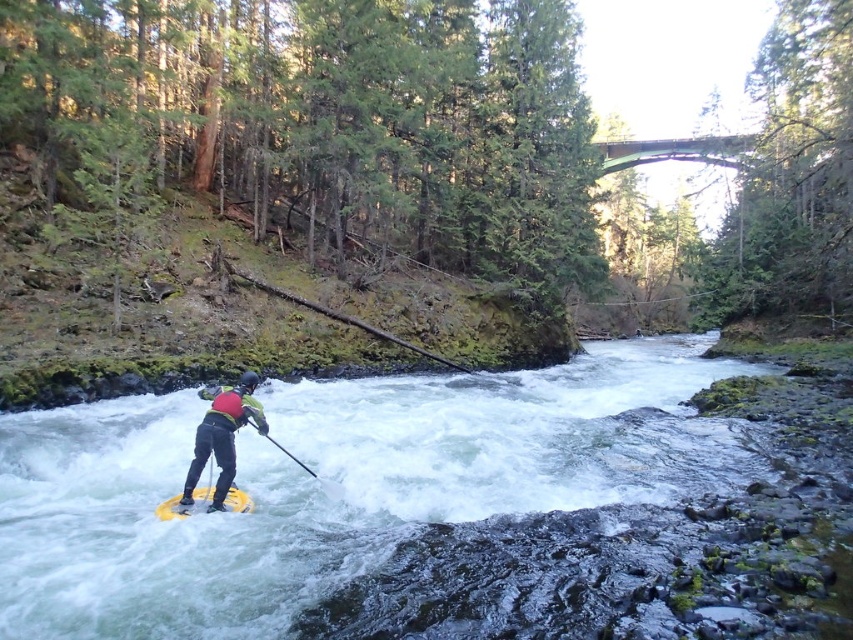
You are a kayaker in the river and you want to know if your yellow rubber canoe at center can fit through a narrow passage between two rocks that is just wide enough for your black plastic paddle at center. Can it fit?

The yellow rubber canoe at center might be wider than black plastic paddle at center, so it may not fit through the narrow passage designed for the paddle.

You are a kayaker preparing to navigate a section of the river where the current is particularly strong. You notice a yellow foam paddleboard at center and a yellow foam paddle at center in the water. Given that the distance between them is 27.41 inches, can you safely maneuver your kayak between them without touching either object?

The yellow foam paddleboard at center and yellow foam paddle at center are 27.41 inches apart. Since the average width of a kayak is about 22 to 26 inches, there is sufficient space to maneuver between them safely as long as you maintain precise control.

You are a kayaker preparing to navigate a rapid. You see a yellow foam paddleboard at center and a yellow foam paddle at center. Which object is wider?

The yellow foam paddleboard at center is wider than the yellow foam paddle at center.